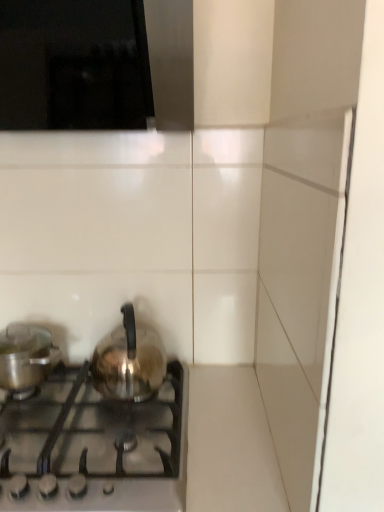
What do you see at coordinates (25, 356) in the screenshot?
I see `shiny metallic pot at left, the first kitchen appliance positioned from the left` at bounding box center [25, 356].

Describe the element at coordinates (129, 361) in the screenshot. I see `shiny metallic kettle at center, the 1th kitchen appliance in the right-to-left sequence` at that location.

The width and height of the screenshot is (384, 512). In order to click on shiny metallic pot at left, the 2th kitchen appliance from the right in this screenshot , I will do `click(25, 356)`.

Is the depth of shiny metallic kettle at lower left greater than that of shiny metallic pot at left, the 2th kitchen appliance from the right?

No, it is in front of shiny metallic pot at left, the 2th kitchen appliance from the right.

Considering the points (31, 464) and (17, 342), which point is behind, point (31, 464) or point (17, 342)?

The point (17, 342) is farther from the camera.

Considering the relative sizes of shiny metallic kettle at lower left and shiny metallic pot at left, the 2th kitchen appliance from the right, in the image provided, is shiny metallic kettle at lower left smaller than shiny metallic pot at left, the 2th kitchen appliance from the right,?

No, shiny metallic kettle at lower left is not smaller than shiny metallic pot at left, the 2th kitchen appliance from the right.

Is shiny metallic kettle at lower left turned away from shiny metallic pot at left, the 2th kitchen appliance from the right?

No, shiny metallic kettle at lower left is not facing away from shiny metallic pot at left, the 2th kitchen appliance from the right.

Does shiny metallic pot at left, the 2th kitchen appliance from the right, turn towards shiny metallic kettle at lower left?

No, shiny metallic pot at left, the 2th kitchen appliance from the right, is not facing towards shiny metallic kettle at lower left.

From the image's perspective, which is above, shiny metallic pot at left, the 2th kitchen appliance from the right, or shiny metallic kettle at lower left?

shiny metallic pot at left, the 2th kitchen appliance from the right, is shown above in the image.

In the scene shown: Is the surface of shiny metallic pot at left, the first kitchen appliance positioned from the left, in direct contact with shiny metallic kettle at lower left?

No, shiny metallic pot at left, the first kitchen appliance positioned from the left, is not in contact with shiny metallic kettle at lower left.

Between point (3, 374) and point (22, 483), which one is positioned in front?

The point (22, 483) is closer.

From their relative heights in the image, would you say shiny metallic kettle at center, the 1th kitchen appliance in the right-to-left sequence, is taller or shorter than shiny metallic kettle at lower left?

Considering their sizes, shiny metallic kettle at center, the 1th kitchen appliance in the right-to-left sequence, has more height than shiny metallic kettle at lower left.

The image size is (384, 512). I want to click on kitchen appliance that is on the right side of shiny metallic kettle at lower left, so (129, 361).

Looking at the image, does shiny metallic kettle at center, the 2th kitchen appliance when ordered from left to right, seem bigger or smaller compared to shiny metallic kettle at lower left?

shiny metallic kettle at center, the 2th kitchen appliance when ordered from left to right, is smaller than shiny metallic kettle at lower left.

Does shiny metallic kettle at center, the 1th kitchen appliance in the right-to-left sequence, turn towards shiny metallic kettle at lower left?

No.

From the image's perspective, is shiny metallic kettle at center, the 1th kitchen appliance in the right-to-left sequence, on top of shiny metallic pot at left, the first kitchen appliance positioned from the left?

Indeed, from the image's perspective, shiny metallic kettle at center, the 1th kitchen appliance in the right-to-left sequence, is shown above shiny metallic pot at left, the first kitchen appliance positioned from the left.

Considering the positions of point (113, 358) and point (43, 350), is point (113, 358) closer or farther from the camera than point (43, 350)?

Clearly, point (113, 358) is closer to the camera than point (43, 350).

Is shiny metallic kettle at center, the 1th kitchen appliance in the right-to-left sequence, with shiny metallic pot at left, the first kitchen appliance positioned from the left?

shiny metallic kettle at center, the 1th kitchen appliance in the right-to-left sequence, is not next to shiny metallic pot at left, the first kitchen appliance positioned from the left, and they're not touching.

From a real-world perspective, who is located lower, shiny metallic kettle at center, the 1th kitchen appliance in the right-to-left sequence, or shiny metallic pot at left, the 2th kitchen appliance from the right?

shiny metallic pot at left, the 2th kitchen appliance from the right, from a real-world perspective.

Is shiny metallic pot at left, the first kitchen appliance positioned from the left, to the right of shiny metallic kettle at center, the 1th kitchen appliance in the right-to-left sequence, from the viewer's perspective?

No, shiny metallic pot at left, the first kitchen appliance positioned from the left, is not to the right of shiny metallic kettle at center, the 1th kitchen appliance in the right-to-left sequence.

Looking at their sizes, would you say shiny metallic pot at left, the first kitchen appliance positioned from the left, is wider or thinner than shiny metallic kettle at center, the 2th kitchen appliance when ordered from left to right?

Clearly, shiny metallic pot at left, the first kitchen appliance positioned from the left, has less width compared to shiny metallic kettle at center, the 2th kitchen appliance when ordered from left to right.

Is shiny metallic pot at left, the 2th kitchen appliance from the right, bigger than shiny metallic kettle at center, the 1th kitchen appliance in the right-to-left sequence?

No, shiny metallic pot at left, the 2th kitchen appliance from the right, is not bigger than shiny metallic kettle at center, the 1th kitchen appliance in the right-to-left sequence.

Considering the relative positions of shiny metallic pot at left, the first kitchen appliance positioned from the left, and shiny metallic kettle at center, the 1th kitchen appliance in the right-to-left sequence, in the image provided, is shiny metallic pot at left, the first kitchen appliance positioned from the left, behind shiny metallic kettle at center, the 1th kitchen appliance in the right-to-left sequence,?

Yes, shiny metallic pot at left, the first kitchen appliance positioned from the left, is behind shiny metallic kettle at center, the 1th kitchen appliance in the right-to-left sequence.

This screenshot has width=384, height=512. Find the location of `gas stove in front of the shiny metallic kettle at center, the 1th kitchen appliance in the right-to-left sequence`. gas stove in front of the shiny metallic kettle at center, the 1th kitchen appliance in the right-to-left sequence is located at coordinates (97, 448).

Which is in front, point (109, 490) or point (129, 334)?

The point (109, 490) is closer to the camera.

Locate an element on the screen. gas stove in front of the shiny metallic pot at left, the 2th kitchen appliance from the right is located at coordinates (97, 448).

Identify the location of kitchen appliance on the left of shiny metallic kettle at lower left. The width and height of the screenshot is (384, 512). (25, 356).

Considering their positions, is shiny metallic kettle at lower left positioned closer to shiny metallic kettle at center, the 1th kitchen appliance in the right-to-left sequence, than shiny metallic pot at left, the first kitchen appliance positioned from the left?

Among the two, shiny metallic kettle at lower left is located nearer to shiny metallic kettle at center, the 1th kitchen appliance in the right-to-left sequence.

Which object lies further to the anchor point shiny metallic pot at left, the 2th kitchen appliance from the right, shiny metallic kettle at lower left or shiny metallic kettle at center, the 1th kitchen appliance in the right-to-left sequence?

Based on the image, shiny metallic kettle at lower left appears to be further to shiny metallic pot at left, the 2th kitchen appliance from the right.

When comparing their distances from shiny metallic kettle at center, the 2th kitchen appliance when ordered from left to right, does shiny metallic pot at left, the 2th kitchen appliance from the right, or shiny metallic kettle at lower left seem closer?

shiny metallic kettle at lower left lies closer to shiny metallic kettle at center, the 2th kitchen appliance when ordered from left to right, than the other object.

Considering their positions, is shiny metallic pot at left, the first kitchen appliance positioned from the left, positioned closer to shiny metallic kettle at lower left than shiny metallic kettle at center, the 2th kitchen appliance when ordered from left to right?

Among the two, shiny metallic kettle at center, the 2th kitchen appliance when ordered from left to right, is located nearer to shiny metallic kettle at lower left.

Consider the image. Estimate the real-world distances between objects in this image. Which object is closer to shiny metallic kettle at lower left, shiny metallic kettle at center, the 1th kitchen appliance in the right-to-left sequence, or shiny metallic pot at left, the 2th kitchen appliance from the right?

shiny metallic kettle at center, the 1th kitchen appliance in the right-to-left sequence, is closer to shiny metallic kettle at lower left.

When comparing their distances from shiny metallic pot at left, the first kitchen appliance positioned from the left, does shiny metallic kettle at center, the 2th kitchen appliance when ordered from left to right, or shiny metallic kettle at lower left seem closer?

shiny metallic kettle at center, the 2th kitchen appliance when ordered from left to right, is positioned closer to the anchor shiny metallic pot at left, the first kitchen appliance positioned from the left.

Find the location of a particular element. The height and width of the screenshot is (512, 384). gas stove located between shiny metallic pot at left, the first kitchen appliance positioned from the left, and shiny metallic kettle at center, the 2th kitchen appliance when ordered from left to right, in the left-right direction is located at coordinates (97, 448).